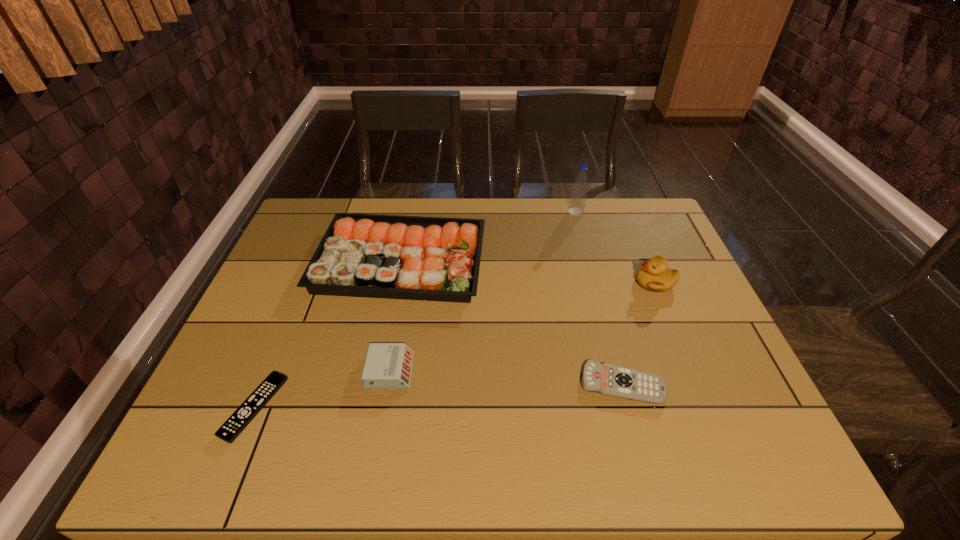
The height and width of the screenshot is (540, 960). In order to click on vacant space at the far right corner of the desktop in this screenshot , I will do `click(625, 226)`.

Where is `free space at the near right corner of the desktop`? This screenshot has width=960, height=540. free space at the near right corner of the desktop is located at coordinates (754, 470).

Find the location of `free space between the third shortest object and the taller remote control`. free space between the third shortest object and the taller remote control is located at coordinates (506, 377).

Identify the location of free area in between the tallest object and the shortest object. (416, 309).

Identify the location of unoccupied area between the fourth shortest object and the right remote control. Image resolution: width=960 pixels, height=540 pixels. (512, 322).

At what (x,y) coordinates should I click in order to perform the action: click on vacant point located between the alarm clock and the fifth tallest object. Please return your answer as a coordinate pair (x, y). The width and height of the screenshot is (960, 540). Looking at the image, I should click on (506, 377).

This screenshot has width=960, height=540. In order to click on free space between the right remote control and the rightmost object in this screenshot , I will do `click(638, 333)`.

This screenshot has height=540, width=960. What are the coordinates of `vacant area between the third tallest object and the left remote control` in the screenshot? It's located at (327, 334).

Identify the location of blank region between the second shortest object and the tallest object. (599, 298).

Image resolution: width=960 pixels, height=540 pixels. Identify the location of vacant space that is in between the fifth shortest object and the water bottle. (615, 247).